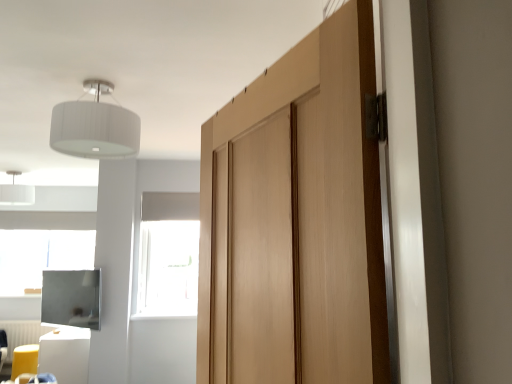
Question: Is point (101, 148) positioned closer to the camera than point (31, 332)?

Choices:
 (A) farther
 (B) closer

Answer: (B)

Question: From the image's perspective, is white fabric lampshade at upper left, acting as the second light fixture starting from the back, located above or below white plastic radiator at lower left?

Choices:
 (A) below
 (B) above

Answer: (B)

Question: Estimate the real-world distances between objects in this image. Which object is farther from the white fabric lampshade at upper left, arranged as the 2th light fixture when viewed from the left?

Choices:
 (A) natural wood door at center
 (B) yellow fabric stool at lower left, acting as the 1th furniture starting from the left
 (C) white fabric lampshade at upper left, the 1th light fixture viewed from the back
 (D) white glossy cube at lower left, which is counted as the first furniture, starting from the right
 (E) matte black screen at lower left

Answer: (C)

Question: Which is farther from the transparent glass window at center?

Choices:
 (A) white plastic radiator at lower left
 (B) white fabric lampshade at upper left, the 1th light fixture viewed from the back
 (C) white fabric lampshade at upper left, the 1th light fixture when ordered from front to back
 (D) natural wood door at center
 (E) yellow fabric stool at lower left, acting as the 1th furniture starting from the left

Answer: (D)